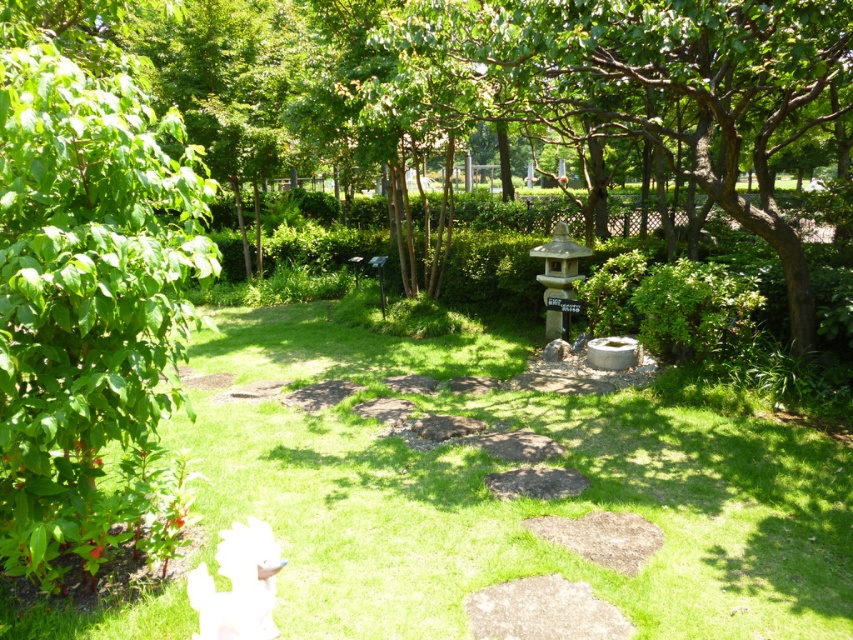
You are standing in the garden and want to walk from the green leafy tree at left to the smooth stone lantern at center. Which direction should you move towards?

You should move towards the center direction because the smooth stone lantern at center is further away from the green leafy tree at left, which is closer to you.

Looking at this image, you are standing in the garden and want to take a photo of both the green leafy tree at left and the smooth stone lantern at center. Which object should you position closer to the camera to include both in the frame?

The green leafy tree at left is below the smooth stone lantern at center, so to include both in the frame, position the green leafy tree at left closer to the camera.

You are planning to place a 2.5 meter long bench in the garden between the green grass at center and the smooth stone lantern at center. Will there be enough space for the bench to fit between them?

The green grass at center and smooth stone lantern at center are 3.92 meters apart. Since the bench is 2.5 meters long, there is sufficient space between them to place the bench.